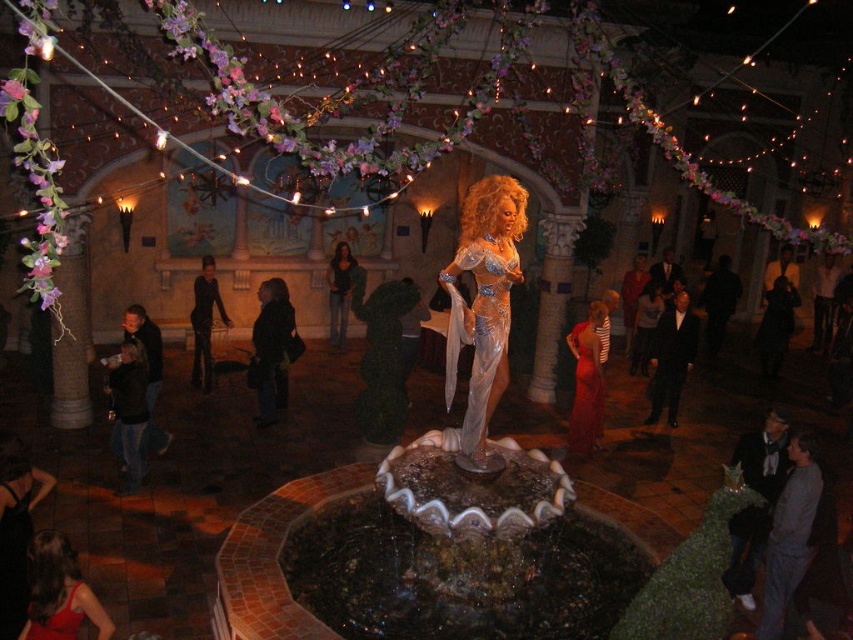
Who is more distant from viewer, (53, 580) or (584, 449)?

Positioned behind is point (584, 449).

From the picture: Can you confirm if matte red dress at lower left is positioned to the right of shiny red dress at center?

Incorrect, matte red dress at lower left is not on the right side of shiny red dress at center.

I want to click on matte red dress at lower left, so click(x=59, y=593).

Locate an element on the screen. Image resolution: width=853 pixels, height=640 pixels. matte red dress at lower left is located at coordinates (59, 593).

Is translucent silver dress at center above shiny red dress at lower left?

Yes.

Looking at this image, is translucent silver dress at center behind shiny red dress at lower left?

Yes.

Which is in front, point (506, 280) or point (39, 627)?

Point (39, 627) is more forward.

Where is `translucent silver dress at center`? The height and width of the screenshot is (640, 853). translucent silver dress at center is located at coordinates (479, 328).

Does dark brown leather jacket at center come behind shiny red dress at lower left?

Yes, it is.

Does point (349, 280) come farther from viewer compared to point (44, 620)?

Yes, point (349, 280) is behind point (44, 620).

Between point (335, 273) and point (62, 608), which one is positioned in front?

Point (62, 608)

Find the location of a particular element. dark brown leather jacket at center is located at coordinates pyautogui.click(x=339, y=291).